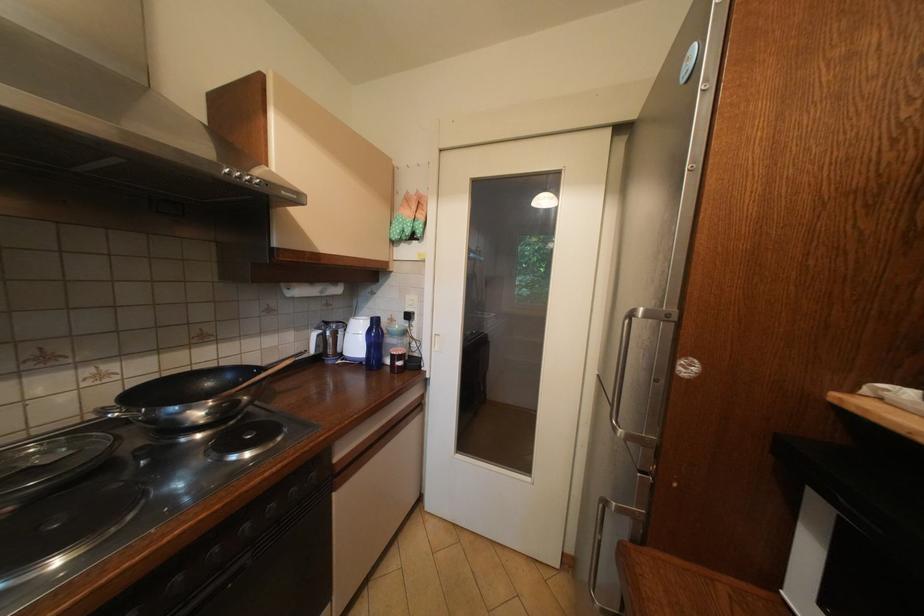
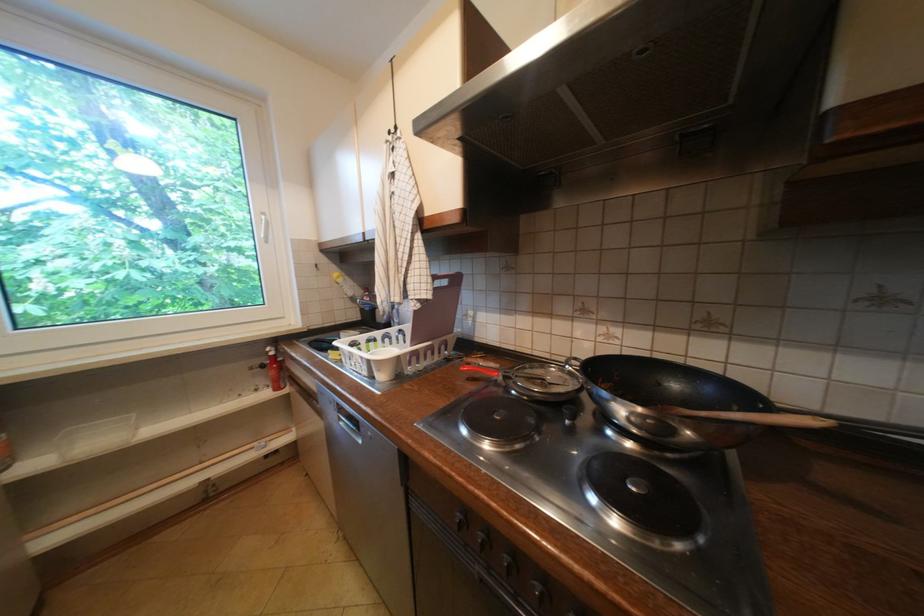
Question: How did the camera likely rotate?

Choices:
 (A) Left
 (B) Right
 (C) Up
 (D) Down

Answer: (A)